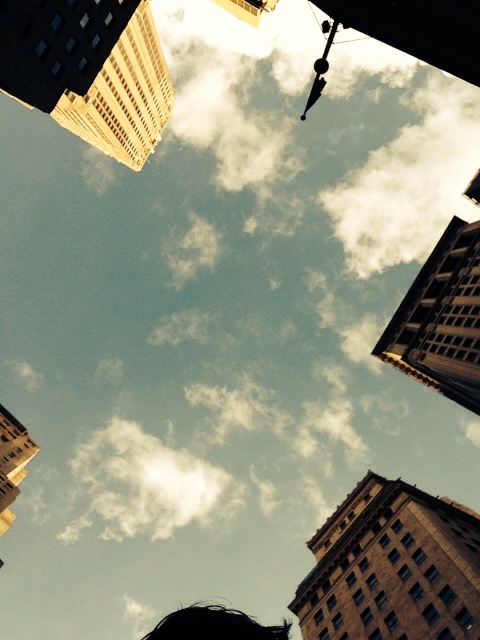
You are a photographer standing in the middle of the city looking up. You notice the white fluffy cloud at center and the black hair at lower center in your viewfinder. Which object appears larger in your current perspective?

The white fluffy cloud at center appears larger than the black hair at lower center because it is bigger in size according to the description.